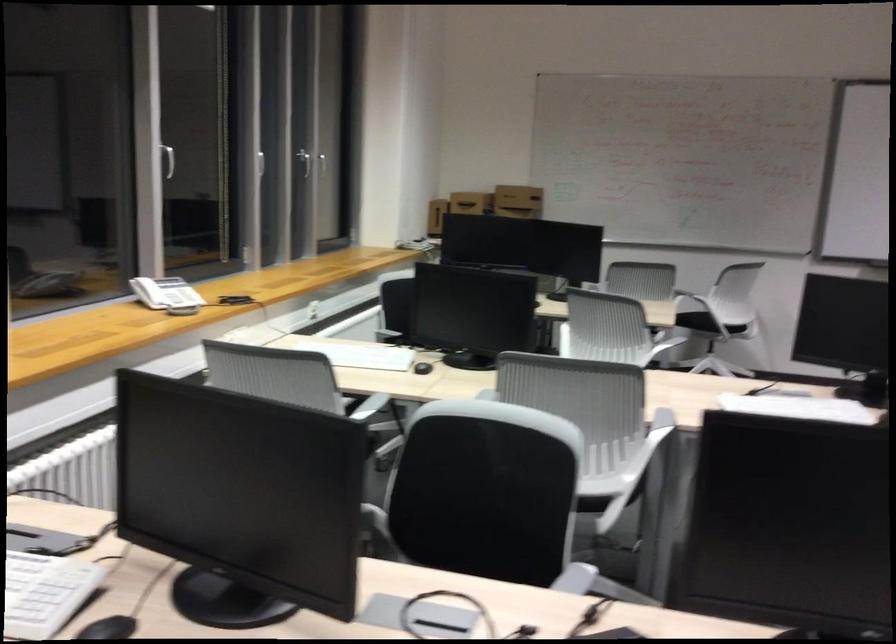
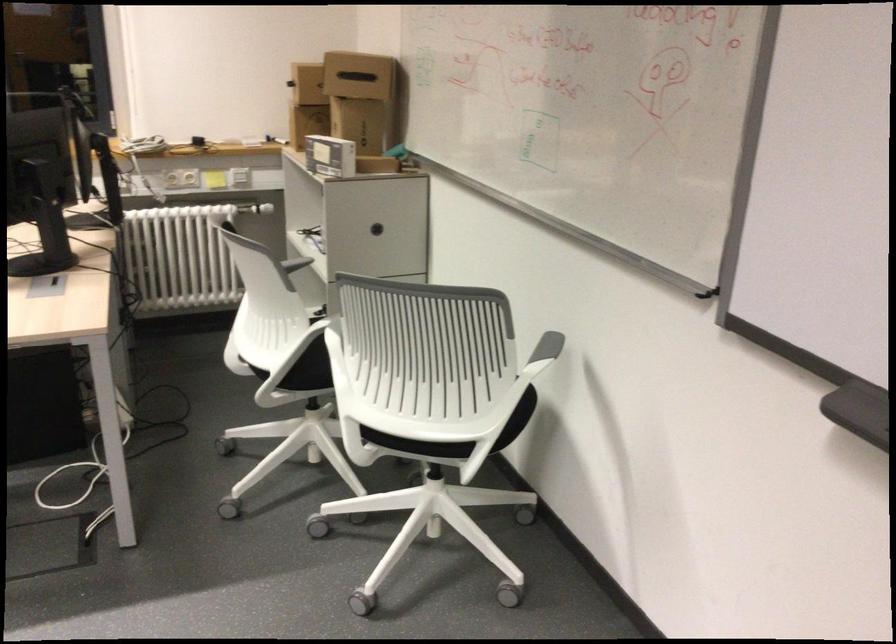
In the second image, find the point that corresponds to (762,315) in the first image.

(418, 444)